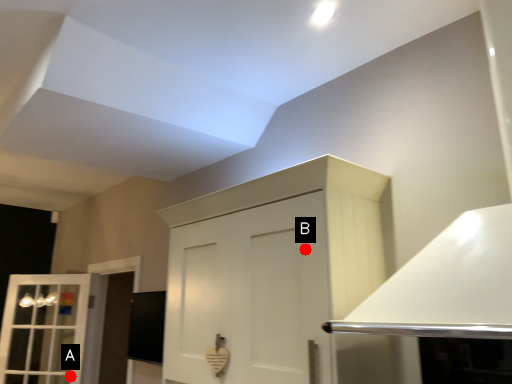
Question: Two points are circled on the image, labeled by A and B beside each circle. Which point appears farthest from the camera in this image?

Choices:
 (A) A is further
 (B) B is further

Answer: (A)